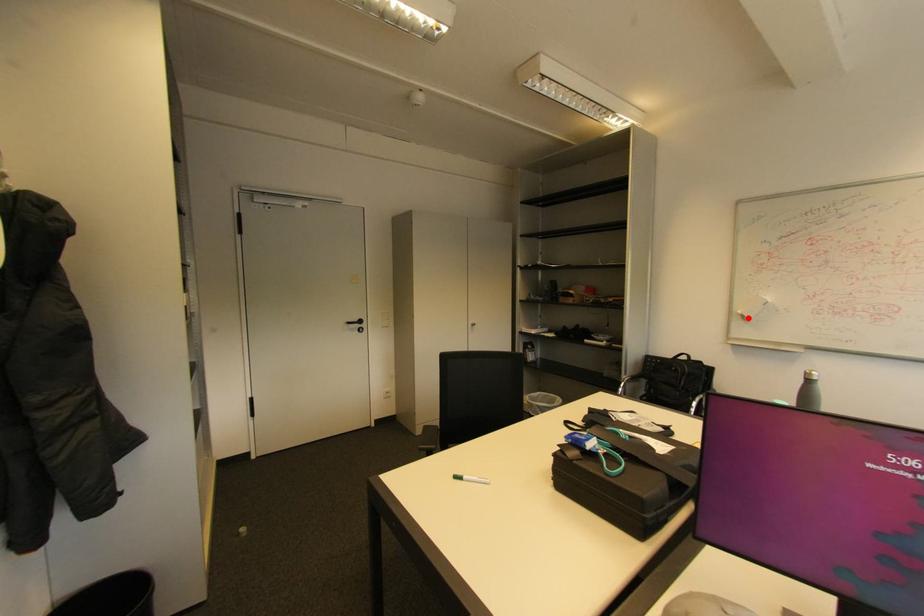
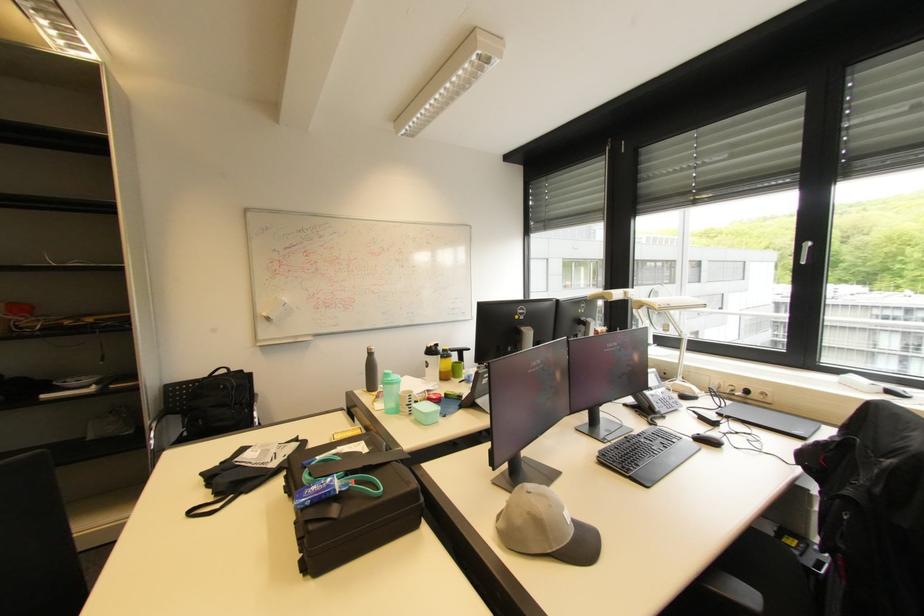
Locate, in the second image, the point that corresponds to the highlighted location in the first image.

(273, 320)